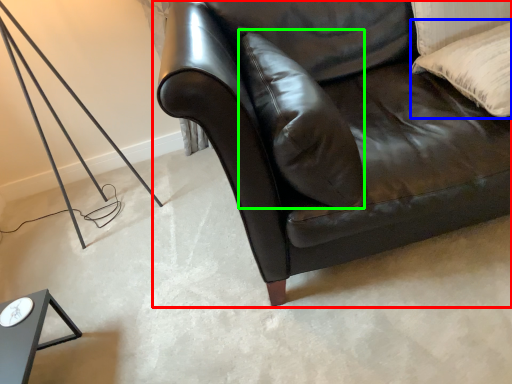
Question: Which object is the farthest from studio couch (highlighted by a red box)? Choose among these: pillow (highlighted by a blue box) or pillow (highlighted by a green box).

Choices:
 (A) pillow
 (B) pillow

Answer: (A)